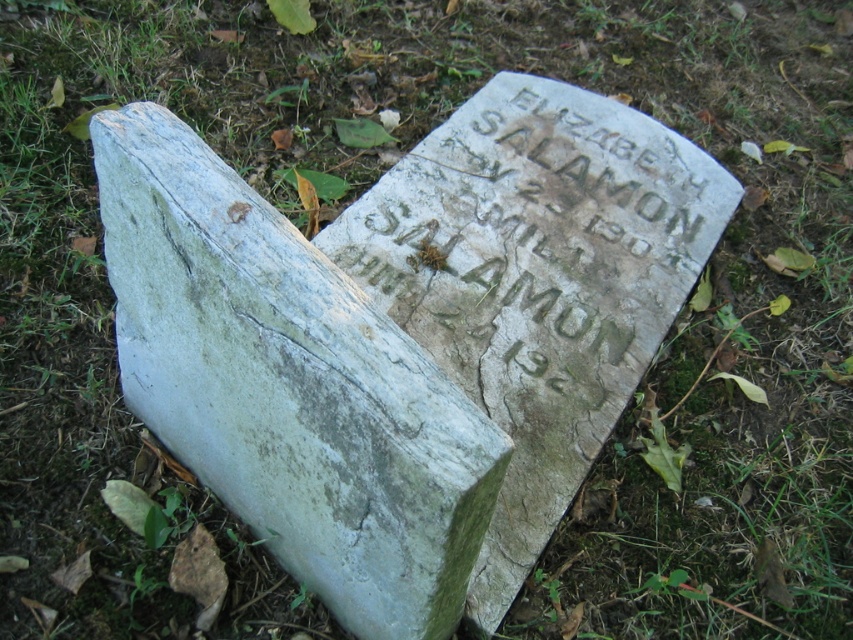
Can you confirm if white stone gravestone at center is thinner than carved stone inscription at center?

Yes, white stone gravestone at center is thinner than carved stone inscription at center.

Who is shorter, white stone gravestone at center or carved stone inscription at center?

With less height is white stone gravestone at center.

This screenshot has width=853, height=640. Describe the element at coordinates (289, 387) in the screenshot. I see `white stone gravestone at center` at that location.

Identify the location of white stone gravestone at center. coord(289,387).